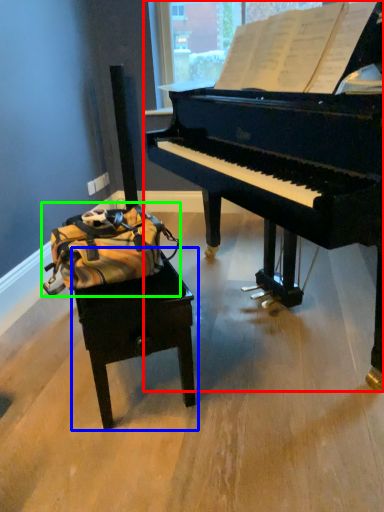
Question: Which object is the farthest from piano (highlighted by a red box)? Choose among these: table (highlighted by a blue box) or messenger bag (highlighted by a green box).

Choices:
 (A) table
 (B) messenger bag

Answer: (A)